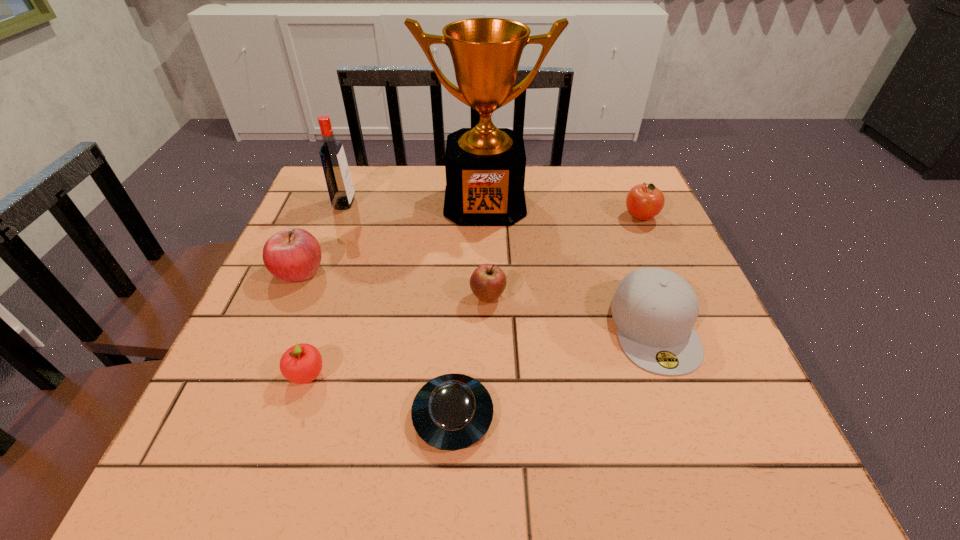
Where is `blank space at the near right corner of the desktop`? This screenshot has width=960, height=540. blank space at the near right corner of the desktop is located at coordinates (696, 468).

Locate an element on the screen. Image resolution: width=960 pixels, height=540 pixels. vacant area that lies between the leftmost apple and the nearest apple is located at coordinates (302, 322).

Where is `unoccupied area between the farthest apple and the leftmost apple`? This screenshot has width=960, height=540. unoccupied area between the farthest apple and the leftmost apple is located at coordinates (469, 244).

Identify the location of free space that is in between the second apple from left to right and the tallest object. (396, 288).

At what (x,y) coordinates should I click in order to perform the action: click on free space between the tallest object and the farthest apple. Please return your answer as a coordinate pair (x, y). Looking at the image, I should click on 563,210.

Locate an element on the screen. Image resolution: width=960 pixels, height=540 pixels. free space between the leftmost apple and the cap is located at coordinates (476, 299).

Where is `unoccupied area between the vodka and the shortest object`? Image resolution: width=960 pixels, height=540 pixels. unoccupied area between the vodka and the shortest object is located at coordinates (398, 309).

Locate an element on the screen. The image size is (960, 540). free space between the rightmost apple and the saucer is located at coordinates (546, 316).

You are a GUI agent. You are given a task and a screenshot of the screen. Output one action in this format:
    pyautogui.click(x=<x>, y=<y>)
    Task: Click on the vacant point located between the rightmost apple and the leftmost apple
    The width and height of the screenshot is (960, 540).
    Given the screenshot: What is the action you would take?
    pyautogui.click(x=469, y=244)

Identify which object is located as the sixth nearest to the leftmost apple. Please provide its 2D coordinates. Your answer should be formatted as a tuple, i.e. [(x, y)], where the tuple contains the x and y coordinates of a point satisfying the conditions above.

[(655, 309)]